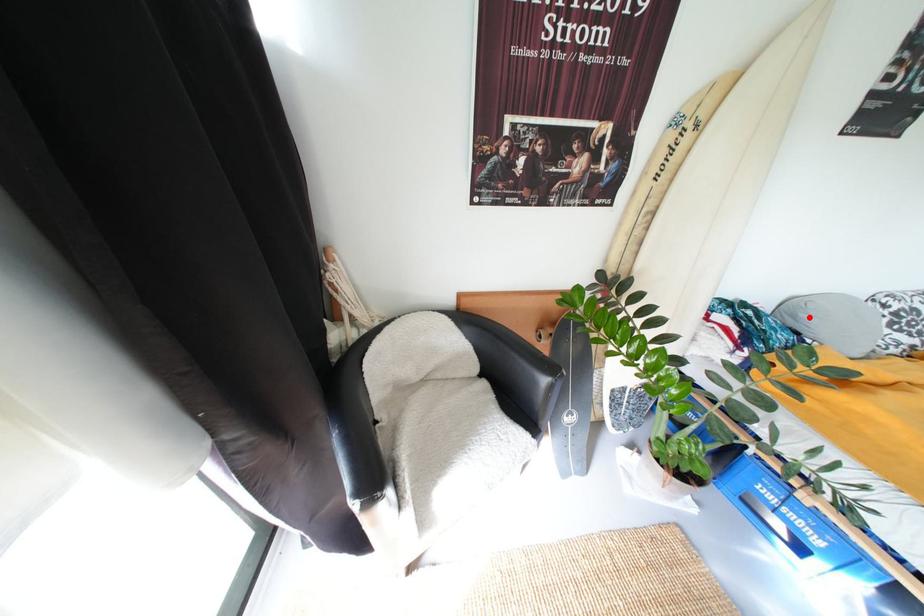
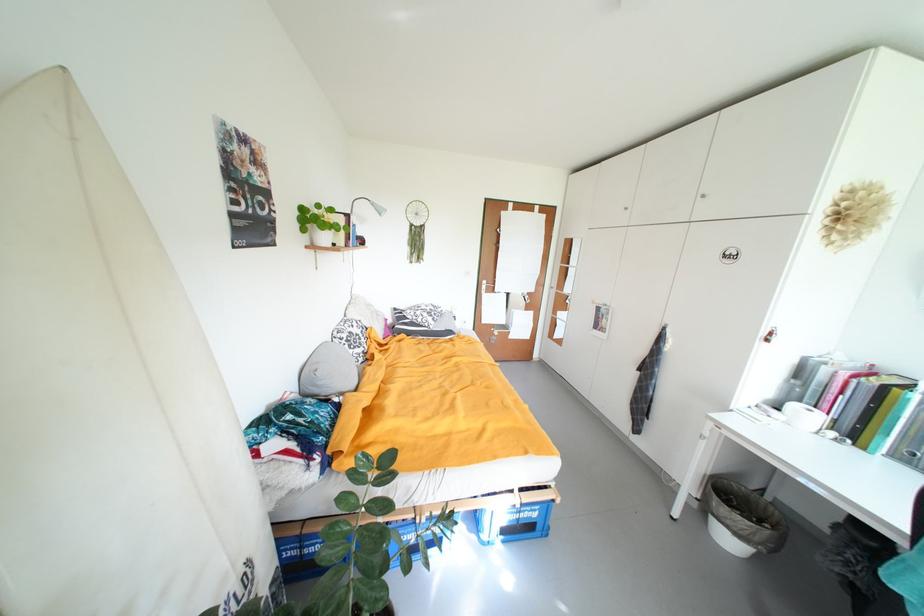
In the second image, find the point that corresponds to the highlighted location in the first image.

(326, 385)